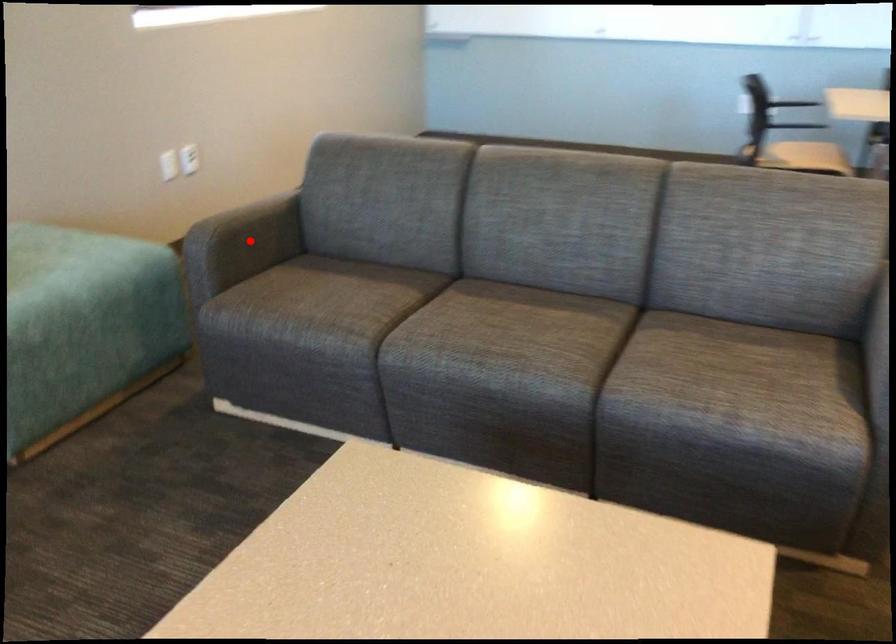
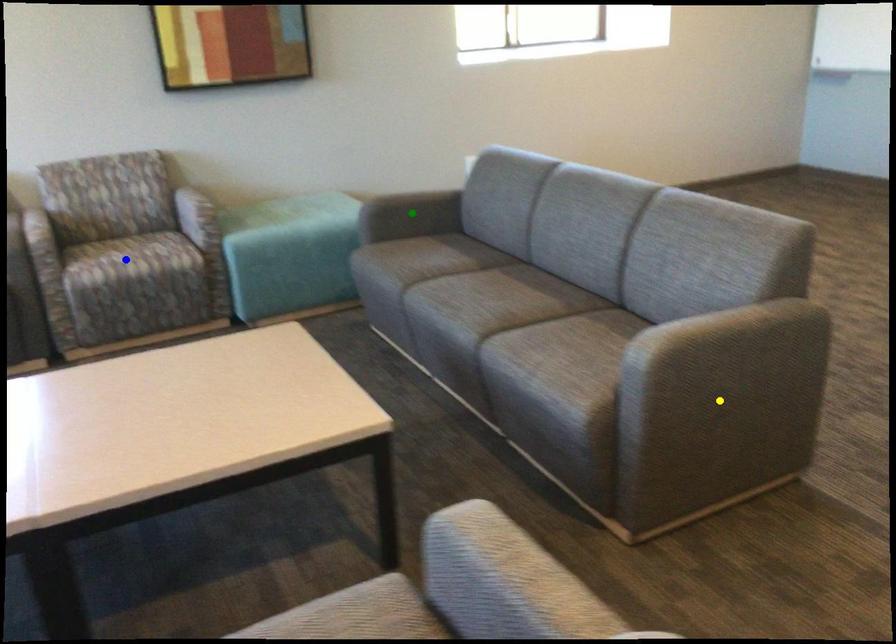
Question: I am providing you with two images of the same scene from different viewpoints. A red point is marked on the first image. You are given multiple points on the second image. Which point in image 2 is actually the same real-world point as the red point in image 1?

Choices:
 (A) blue point
 (B) green point
 (C) yellow point

Answer: (B)